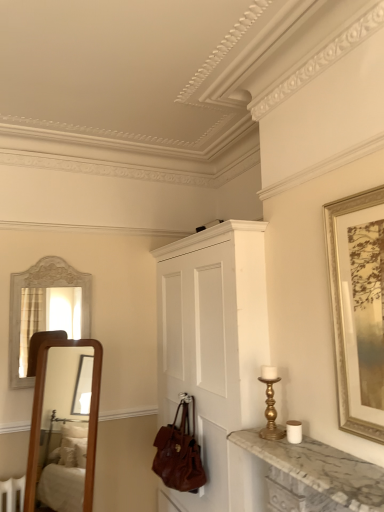
Question: Is brown leather handbag at lower center completely or partially outside of gold-framed artwork at right?

Choices:
 (A) no
 (B) yes

Answer: (B)

Question: Considering the relative sizes of brown leather handbag at lower center and gold-framed artwork at right in the image provided, is brown leather handbag at lower center bigger than gold-framed artwork at right?

Choices:
 (A) no
 (B) yes

Answer: (B)

Question: Is brown leather handbag at lower center to the left of gold-framed artwork at right from the viewer's perspective?

Choices:
 (A) no
 (B) yes

Answer: (B)

Question: From a real-world perspective, is brown leather handbag at lower center positioned under gold-framed artwork at right based on gravity?

Choices:
 (A) yes
 (B) no

Answer: (A)

Question: Is brown leather handbag at lower center not near gold-framed artwork at right?

Choices:
 (A) no
 (B) yes

Answer: (B)

Question: Does brown leather handbag at lower center have a lesser height compared to gold-framed artwork at right?

Choices:
 (A) yes
 (B) no

Answer: (A)

Question: Considering the relative sizes of white painted wood cabinet at center and gold metallic candle holder at right in the image provided, is white painted wood cabinet at center smaller than gold metallic candle holder at right?

Choices:
 (A) no
 (B) yes

Answer: (A)

Question: Does white painted wood cabinet at center lie in front of gold metallic candle holder at right?

Choices:
 (A) yes
 (B) no

Answer: (B)

Question: From a real-world perspective, is white painted wood cabinet at center positioned under gold metallic candle holder at right based on gravity?

Choices:
 (A) no
 (B) yes

Answer: (B)

Question: From a real-world perspective, is white painted wood cabinet at center located higher than gold metallic candle holder at right?

Choices:
 (A) no
 (B) yes

Answer: (A)

Question: Is white painted wood cabinet at center positioned beyond the bounds of gold metallic candle holder at right?

Choices:
 (A) no
 (B) yes

Answer: (B)

Question: Can you confirm if white painted wood cabinet at center is positioned to the right of gold metallic candle holder at right?

Choices:
 (A) no
 (B) yes

Answer: (A)

Question: Can you confirm if white painted wood cabinet at center is thinner than brown leather handbag at lower center?

Choices:
 (A) no
 (B) yes

Answer: (A)